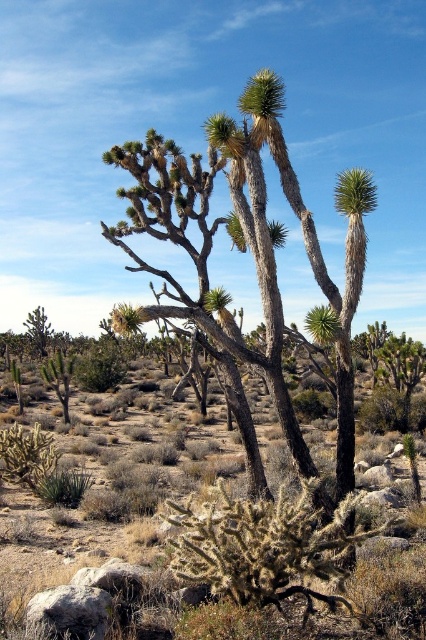
You are a desert explorer carrying a 3.5 meter long rope. You need to secure both the brown spiny cactus at center and the brown textured cactus at center. Can you tie the rope between them without any slack?

The distance between the brown spiny cactus at center and the brown textured cactus at center is 3.47 meters. Since the rope is 3.5 meters long, there will be enough slack to tie them together.

You are standing at the center of the desert scene and want to move towards the brown spiny cactus at center. According to the coordinates provided, in which direction should you walk to reach it?

The brown spiny cactus at center is located at coordinates point (203, 538). Since you are at the center of the desert scene, you should walk towards the direction of the coordinates to reach it. However, without additional reference points or a map, it is difficult to determine the exact direction based solely on these coordinates.

You are standing in the desert scene and want to walk from the point at coordinates point (69,538) to the point at coordinates point (158,157). Considering the desert terrain, which direction should you move to reach your destination?

Since point (69,538) is in front of point (158,157), you should move backward to reach your destination.